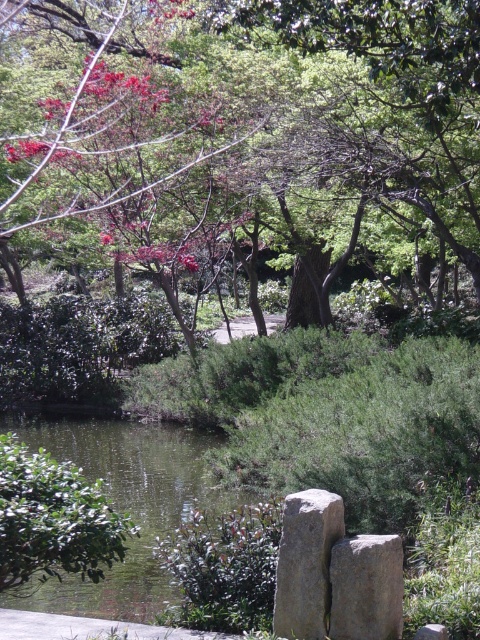
Does green leafy tree at upper center have a smaller size compared to green liquid water at center?

No.

Can you confirm if green leafy tree at upper center is bigger than green liquid water at center?

Yes, green leafy tree at upper center is bigger than green liquid water at center.

I want to click on green leafy tree at upper center, so [276, 116].

Is gray rough stone at center above gray stone at center?

Yes, gray rough stone at center is above gray stone at center.

Between gray rough stone at center and gray stone at center, which one appears on the right side from the viewer's perspective?

gray stone at center is more to the right.

Locate an element on the screen. gray rough stone at center is located at coordinates (305, 563).

This screenshot has height=640, width=480. In order to click on gray rough stone at center in this screenshot , I will do `click(305, 563)`.

Who is positioned more to the left, green leafy tree at upper center or gray stone at center?

green leafy tree at upper center is more to the left.

Is green leafy tree at upper center further to camera compared to gray stone at center?

Yes, it is.

Is point (323, 49) positioned after point (332, 557)?

Yes, point (323, 49) is farther from viewer.

Where is `green leafy tree at upper center`? green leafy tree at upper center is located at coordinates (276, 116).